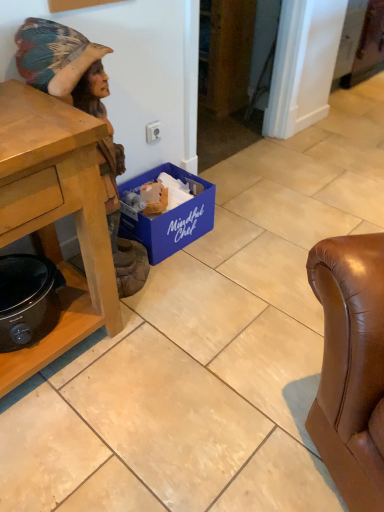
You are a GUI agent. You are given a task and a screenshot of the screen. Output one action in this format:
    pyautogui.click(x=<x>, y=<y>)
    Task: Click on the vacant area in front of blue cardboard box at lower center
    The height and width of the screenshot is (512, 384).
    Given the screenshot: What is the action you would take?
    pos(192,282)